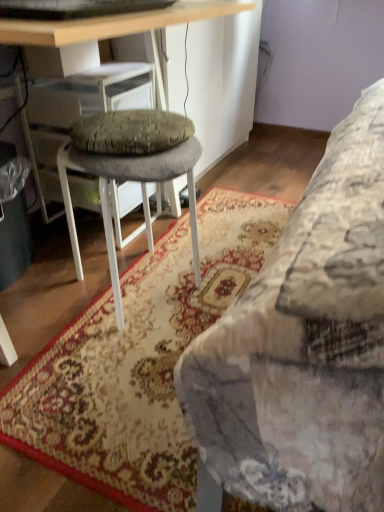
The width and height of the screenshot is (384, 512). I want to click on free point above floral carpet at lower right (from a real-world perspective), so click(179, 293).